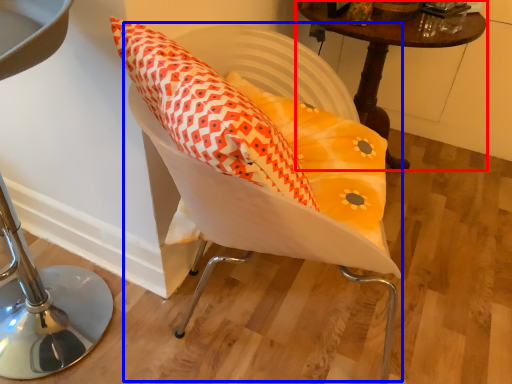
Question: Which object appears farthest to the camera in this image, table (highlighted by a red box) or swivel chair (highlighted by a blue box)?

Choices:
 (A) table
 (B) swivel chair

Answer: (A)